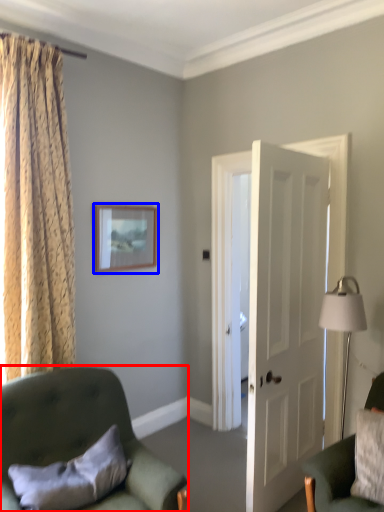
Question: Which object appears closest to the camera in this image, chair (highlighted by a red box) or picture frame (highlighted by a blue box)?

Choices:
 (A) chair
 (B) picture frame

Answer: (A)